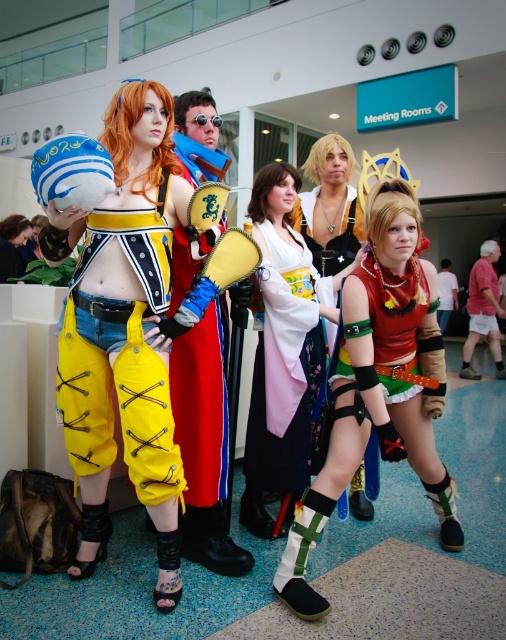
Question: Does matte yellow pants at center appear on the left side of white silk kimono at center?

Choices:
 (A) yes
 (B) no

Answer: (A)

Question: Which point is farther to the camera?

Choices:
 (A) (270, 205)
 (B) (200, 483)

Answer: (A)

Question: Among these points, which one is nearest to the camera?

Choices:
 (A) (484, 288)
 (B) (327, 349)

Answer: (B)

Question: Which of the following is the closest to the observer?

Choices:
 (A) yellow leather pants at center
 (B) yellow fabric pants at center
 (C) silky white kimono at center

Answer: (B)

Question: Considering the relative positions of white silk kimono at center and yellow leather pants at center in the image provided, where is white silk kimono at center located with respect to yellow leather pants at center?

Choices:
 (A) above
 (B) below

Answer: (B)

Question: Can you confirm if matte yellow pants at center is wider than white silk kimono at center?

Choices:
 (A) no
 (B) yes

Answer: (B)